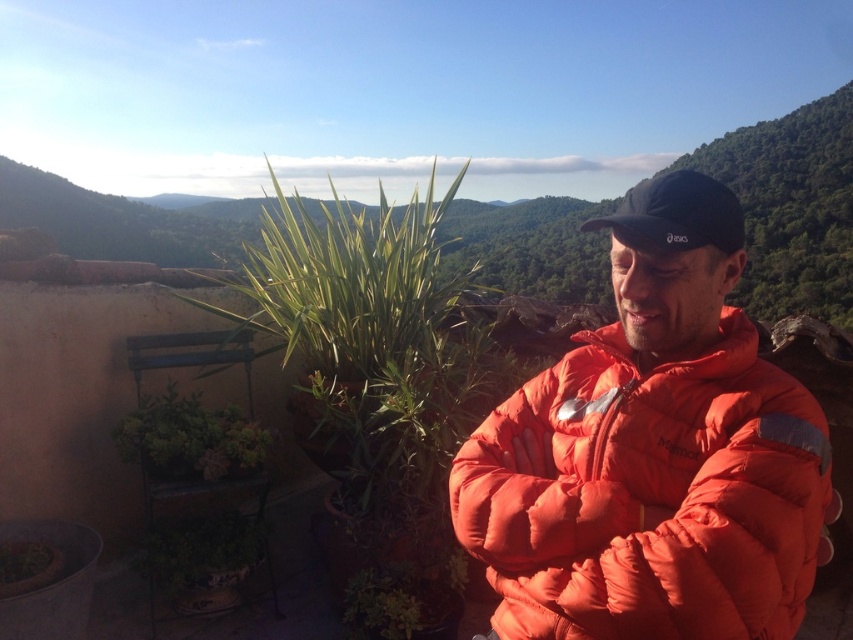
Does orange down jacket at center have a lesser height compared to green succulent at lower left?

Incorrect, orange down jacket at center's height does not fall short of green succulent at lower left's.

Is orange down jacket at center taller than green succulent at lower left?

Yes.

Between point (502, 515) and point (161, 429), which one is positioned behind?

Point (161, 429)

The image size is (853, 640). I want to click on orange down jacket at center, so click(x=653, y=452).

Can you confirm if green succulent at lower left is smaller than black fabric baseball cap at upper right?

Incorrect, green succulent at lower left is not smaller in size than black fabric baseball cap at upper right.

Which is more to the left, green succulent at lower left or black fabric baseball cap at upper right?

green succulent at lower left

Is point (238, 460) closer to camera compared to point (663, 193)?

No, (238, 460) is further to viewer.

Locate an element on the screen. green succulent at lower left is located at coordinates (190, 438).

Which is above, orange down jacket at center or black fabric baseball cap at upper right?

black fabric baseball cap at upper right

Can you confirm if orange down jacket at center is wider than black fabric baseball cap at upper right?

Correct, the width of orange down jacket at center exceeds that of black fabric baseball cap at upper right.

Between point (498, 624) and point (668, 230), which one is positioned in front?

Point (668, 230) is more forward.

This screenshot has width=853, height=640. Find the location of `orange down jacket at center`. orange down jacket at center is located at coordinates (653, 452).